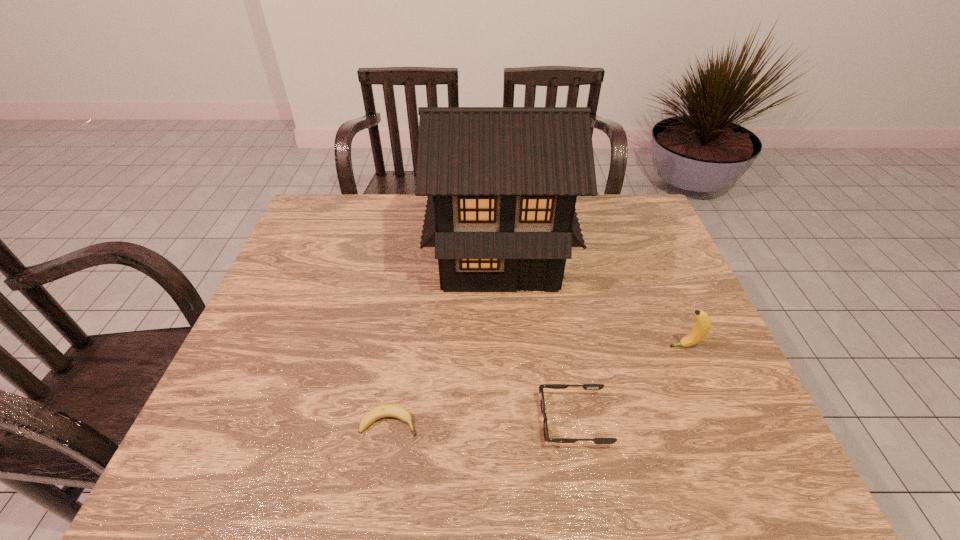
You are a GUI agent. You are given a task and a screenshot of the screen. Output one action in this format:
    pyautogui.click(x=<x>, y=<y>)
    Task: Click on the vacant point located between the third nearest object and the left banana
    
    Given the screenshot: What is the action you would take?
    pyautogui.click(x=538, y=384)

This screenshot has width=960, height=540. I want to click on free space between the rightmost object and the tallest object, so click(592, 300).

Locate an element on the screen. The width and height of the screenshot is (960, 540). free space between the third tallest object and the shorter banana is located at coordinates (482, 422).

I want to click on empty space between the second shortest object and the third shortest object, so click(x=629, y=383).

In order to click on the third closest object to the left banana in this screenshot , I will do `click(701, 328)`.

Point out which object is positioned as the nearest to the farthest object. Please provide its 2D coordinates. Your answer should be formatted as a tuple, i.e. [(x, y)], where the tuple contains the x and y coordinates of a point satisfying the conditions above.

[(701, 328)]

You are a GUI agent. You are given a task and a screenshot of the screen. Output one action in this format:
    pyautogui.click(x=<x>, y=<y>)
    Task: Click on the vacant area that satisfies the following two spatial constraints: 1. on the front-facing side of the tallest object; 2. at the stem of the shorter banana
    
    Given the screenshot: What is the action you would take?
    pyautogui.click(x=507, y=423)

Image resolution: width=960 pixels, height=540 pixels. I want to click on vacant position in the image that satisfies the following two spatial constraints: 1. on the front-facing side of the dollhouse; 2. at the stem of the left banana, so click(x=507, y=423).